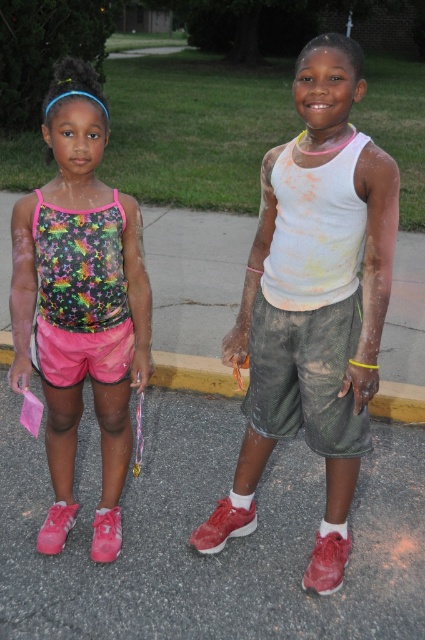
Question: Is white matte tank top at center positioned before yellow concrete curb at center?

Choices:
 (A) no
 (B) yes

Answer: (B)

Question: Which is farther from the yellow concrete curb at center?

Choices:
 (A) white matte tank top at center
 (B) gray asphalt pavement at center
 (C) dark green mesh shorts at center
 (D) neon pink fabric tank top at left

Answer: (A)

Question: Does gray asphalt pavement at center have a smaller size compared to dark green mesh shorts at center?

Choices:
 (A) yes
 (B) no

Answer: (B)

Question: Which point is farther to the camera?

Choices:
 (A) neon pink fabric tank top at left
 (B) yellow concrete curb at center
 (C) dark green mesh shorts at center

Answer: (B)

Question: Which point appears farthest from the camera in this image?

Choices:
 (A) (82, 368)
 (B) (150, 460)
 (C) (357, 227)
 (D) (351, 332)

Answer: (B)

Question: Is gray asphalt pavement at center bigger than dark green mesh shorts at center?

Choices:
 (A) no
 (B) yes

Answer: (B)